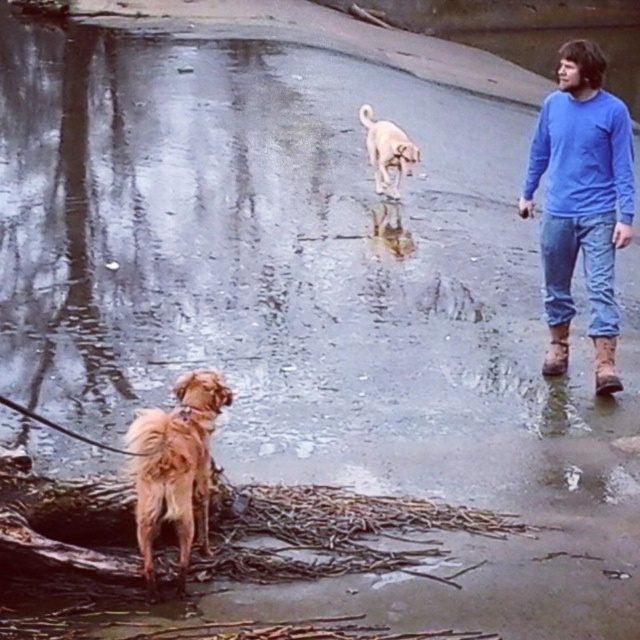
Based on the photo, you are a photographer trying to capture a photo of the golden fur dog at upper center and the blue cotton shirt at right. Which object should you zoom in on to ensure both fit in the frame?

The blue cotton shirt at right is wider than the golden fur dog at upper center, so you should zoom out to include both objects. Zooming in might cause the wider blue cotton shirt at right to be cut off.

You are a photographer trying to capture both the golden fur dog at lower left and the blue cotton sweatshirt at right in the same frame. Which object should you zoom in on to ensure both fit comfortably in the photo?

Since the golden fur dog at lower left is smaller than the blue cotton sweatshirt at right, you should zoom out slightly to accommodate both objects in the frame.